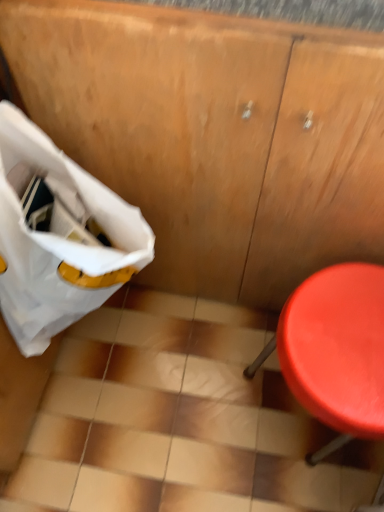
What do you see at coordinates (335, 351) in the screenshot?
I see `smooth plastic stool at right` at bounding box center [335, 351].

The image size is (384, 512). Identify the location of smooth plastic stool at right. (335, 351).

Image resolution: width=384 pixels, height=512 pixels. What do you see at coordinates (58, 236) in the screenshot?
I see `white fabric bag at left` at bounding box center [58, 236].

Where is `white fabric bag at left`? This screenshot has width=384, height=512. white fabric bag at left is located at coordinates (58, 236).

Image resolution: width=384 pixels, height=512 pixels. What are the coordinates of `smooth plastic stool at right` in the screenshot? It's located at (335, 351).

Which object is positioned more to the right, white fabric bag at left or smooth plastic stool at right?

smooth plastic stool at right.

Considering the positions of objects white fabric bag at left and smooth plastic stool at right in the image provided, who is behind, white fabric bag at left or smooth plastic stool at right?

Positioned behind is smooth plastic stool at right.

Is point (32, 146) behind point (351, 409)?

No, (32, 146) is in front of (351, 409).

Consider the image. From the image's perspective, which is above, white fabric bag at left or smooth plastic stool at right?

white fabric bag at left is shown above in the image.

From a real-world perspective, is white fabric bag at left on top of smooth plastic stool at right?

Yes, from a real-world perspective, white fabric bag at left is over smooth plastic stool at right

Is white fabric bag at left wider or thinner than smooth plastic stool at right?

Clearly, white fabric bag at left has less width compared to smooth plastic stool at right.

Can you confirm if white fabric bag at left is shorter than smooth plastic stool at right?

No.

Looking at the image, does white fabric bag at left seem bigger or smaller compared to smooth plastic stool at right?

Considering their sizes, white fabric bag at left takes up less space than smooth plastic stool at right.

Is white fabric bag at left spatially inside smooth plastic stool at right, or outside of it?

white fabric bag at left exists outside the volume of smooth plastic stool at right.

In the scene shown: Is white fabric bag at left with smooth plastic stool at right?

No, white fabric bag at left is not making contact with smooth plastic stool at right.

Is white fabric bag at left positioned with its back to smooth plastic stool at right?

No, white fabric bag at left's orientation is not away from smooth plastic stool at right.

Can you tell me how much white fabric bag at left and smooth plastic stool at right differ in facing direction?

The angle between the facing direction of white fabric bag at left and the facing direction of smooth plastic stool at right is 91.1 degrees.

Measure the distance from white fabric bag at left to smooth plastic stool at right.

A distance of 16.23 inches exists between white fabric bag at left and smooth plastic stool at right.

The width and height of the screenshot is (384, 512). Identify the location of grocery bag above the smooth plastic stool at right (from the image's perspective). (58, 236).

Considering the positions of objects smooth plastic stool at right and white fabric bag at left in the image provided, who is more to the left, smooth plastic stool at right or white fabric bag at left?

From the viewer's perspective, white fabric bag at left appears more on the left side.

Considering their positions, is smooth plastic stool at right located in front of or behind white fabric bag at left?

Clearly, smooth plastic stool at right is behind white fabric bag at left.

Between point (326, 334) and point (43, 170), which one is positioned in front?

The point (326, 334) is more forward.

From the image's perspective, which object appears higher, smooth plastic stool at right or white fabric bag at left?

From the image's view, white fabric bag at left is above.

From a real-world perspective, which is physically below, smooth plastic stool at right or white fabric bag at left?

smooth plastic stool at right is physically lower.

Is smooth plastic stool at right wider than white fabric bag at left?

Correct, the width of smooth plastic stool at right exceeds that of white fabric bag at left.

Which of these two, smooth plastic stool at right or white fabric bag at left, stands shorter?

smooth plastic stool at right is shorter.

Looking at this image, is smooth plastic stool at right smaller than white fabric bag at left?

No, smooth plastic stool at right is not smaller than white fabric bag at left.

Is smooth plastic stool at right located outside white fabric bag at left?

Indeed, smooth plastic stool at right is completely outside white fabric bag at left.

Is there a large distance between smooth plastic stool at right and white fabric bag at left?

No, smooth plastic stool at right is in close proximity to white fabric bag at left.

Could you tell me if smooth plastic stool at right is facing white fabric bag at left?

No, smooth plastic stool at right is not turned towards white fabric bag at left.

Can you tell me how much smooth plastic stool at right and white fabric bag at left differ in facing direction?

There is a 91.1-degree angle between the facing directions of smooth plastic stool at right and white fabric bag at left.

Find the location of a particular element. This screenshot has width=384, height=512. grocery bag that appears on the left of smooth plastic stool at right is located at coordinates (58, 236).

Locate an element on the screen. grocery bag that appears in front of the smooth plastic stool at right is located at coordinates (58, 236).

The height and width of the screenshot is (512, 384). Find the location of `furniture to the right of white fabric bag at left`. furniture to the right of white fabric bag at left is located at coordinates (335, 351).